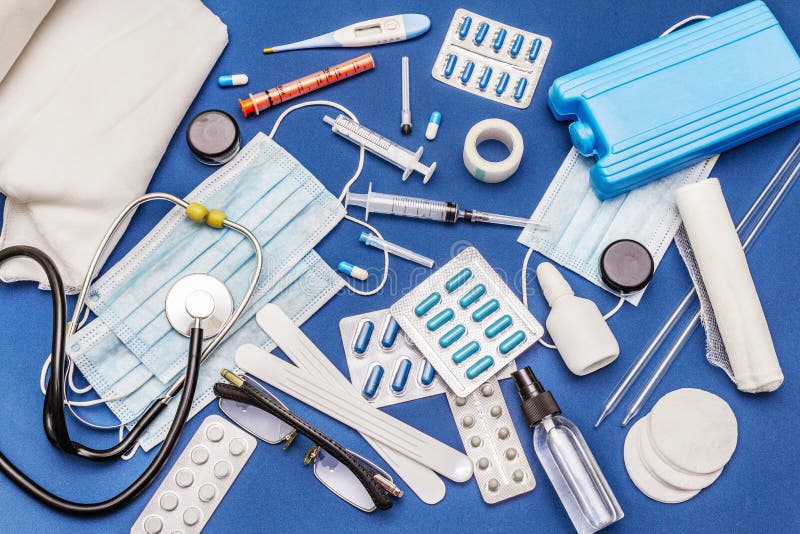
This screenshot has height=534, width=800. What are the coordinates of `medical drape, stethoscope, depressors and thermometer` in the screenshot? It's located at [x=82, y=95], [x=373, y=30], [x=204, y=300], [x=282, y=371], [x=294, y=336].